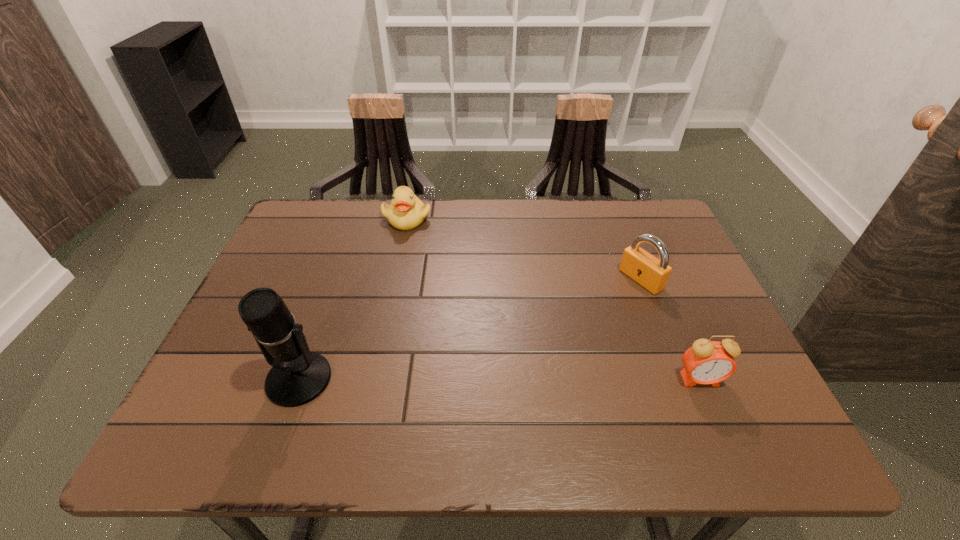
Identify the location of vacant space that's between the microphone and the duckling. The width and height of the screenshot is (960, 540). (353, 299).

Find the location of a particular element. free area in between the microphone and the duckling is located at coordinates (353, 299).

The image size is (960, 540). I want to click on vacant region between the third nearest object and the alarm clock, so click(670, 329).

This screenshot has width=960, height=540. I want to click on vacant area between the alarm clock and the padlock, so click(x=670, y=329).

Locate an element on the screen. This screenshot has width=960, height=540. blank region between the alarm clock and the padlock is located at coordinates (670, 329).

Where is `vacant area that lies between the padlock and the microphone`? This screenshot has width=960, height=540. vacant area that lies between the padlock and the microphone is located at coordinates (470, 329).

The height and width of the screenshot is (540, 960). I want to click on vacant space that's between the duckling and the alarm clock, so click(x=553, y=299).

This screenshot has width=960, height=540. I want to click on object that stands as the third closest to the padlock, so click(x=298, y=376).

Locate which object is the closest to the leftmost object. Please provide its 2D coordinates. Your answer should be formatted as a tuple, i.e. [(x, y)], where the tuple contains the x and y coordinates of a point satisfying the conditions above.

[(406, 211)]

In order to click on free space that satisfies the following two spatial constraints: 1. on the front side of the duckling; 2. on the left side of the third nearest object in this screenshot , I will do `click(395, 279)`.